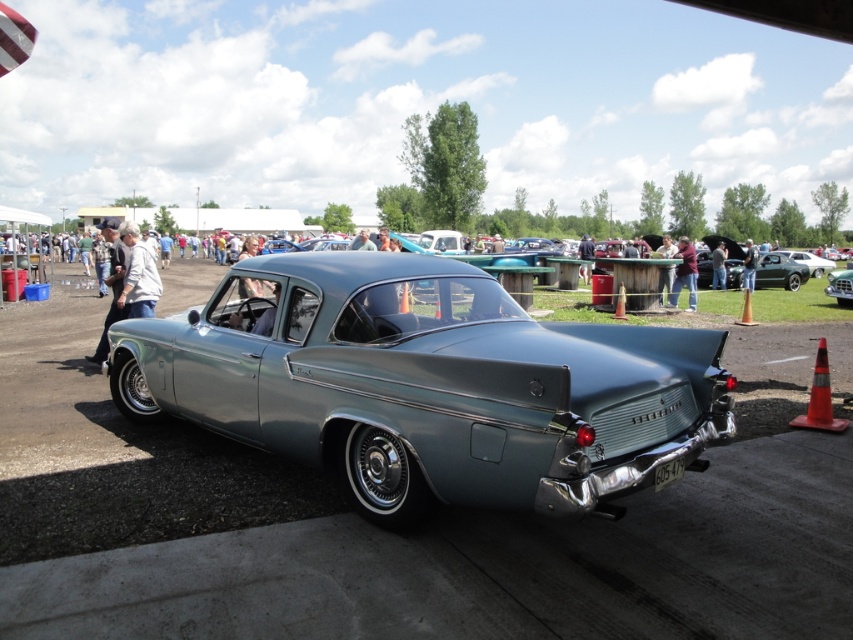
Question: Is metallic gray car at center below denim jacket at center?

Choices:
 (A) yes
 (B) no

Answer: (A)

Question: Is light gray fabric jacket at left positioned behind shiny chrome grille at center?

Choices:
 (A) yes
 (B) no

Answer: (B)

Question: Does light gray fabric jacket at left appear over maroon fabric shirt at center?

Choices:
 (A) yes
 (B) no

Answer: (B)

Question: Which point is farther to the camera?

Choices:
 (A) (618, 292)
 (B) (834, 296)

Answer: (B)

Question: Which point appears farthest from the camera in this image?

Choices:
 (A) (747, 317)
 (B) (712, 266)

Answer: (B)

Question: Which is nearer to the shiny chrome grille at center?

Choices:
 (A) light gray fabric jacket at left
 (B) maroon fabric shirt at center
 (C) orange cone at center
 (D) orange reflective cone at lower right

Answer: (B)